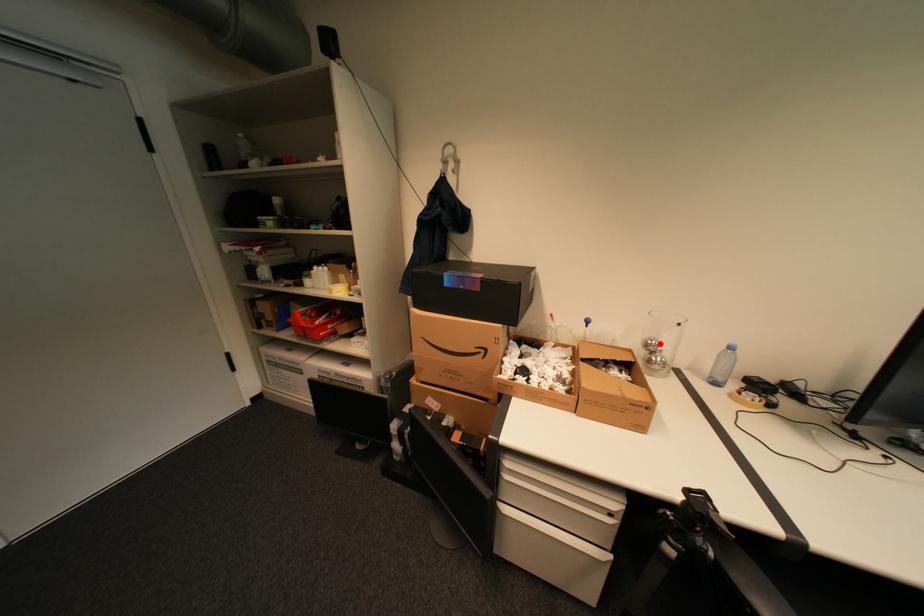
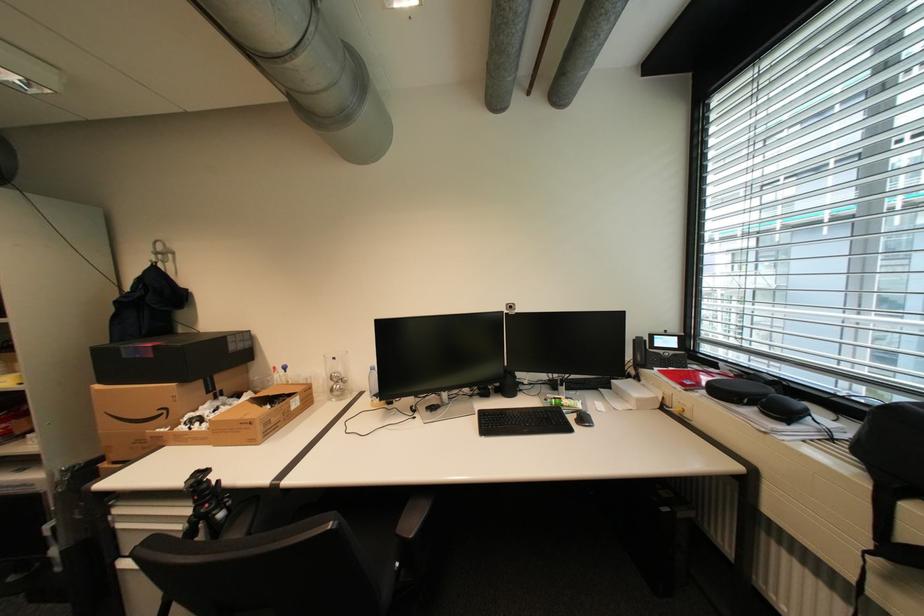
In the second image, find the point that corresponds to the highlighted location in the first image.

(343, 376)